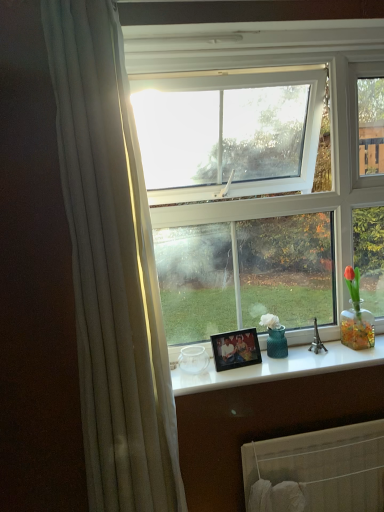
Question: From the image's perspective, is white glossy counter top at center above or below white fabric radiator at lower center?

Choices:
 (A) above
 (B) below

Answer: (A)

Question: Is white glossy counter top at center to the left or to the right of white fabric radiator at lower center in the image?

Choices:
 (A) left
 (B) right

Answer: (A)

Question: Which is nearer to the white fabric radiator at lower center?

Choices:
 (A) white glossy counter top at center
 (B) wooden photo frame at center

Answer: (A)

Question: Which of these objects is positioned closest to the wooden photo frame at center?

Choices:
 (A) white glossy counter top at center
 (B) white fabric radiator at lower center

Answer: (A)